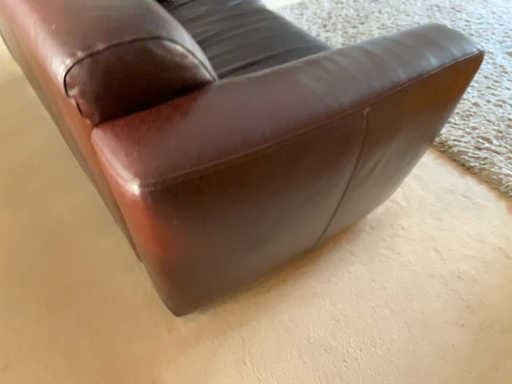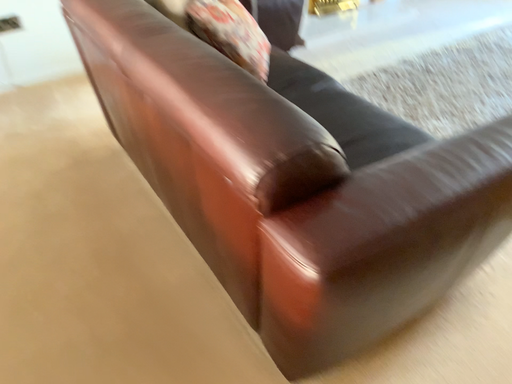
Question: How did the camera likely rotate when shooting the video?

Choices:
 (A) rotated downward
 (B) rotated upward

Answer: (B)